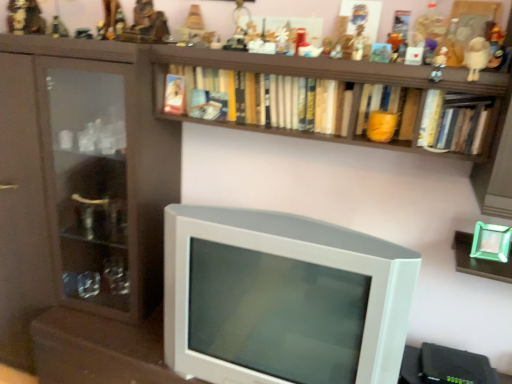
Question: Is metallic figurine at upper center, placed as the eighth toy when sorted from right to left, taller or shorter than hardcover books at upper center, acting as the 3th book starting from the right?

Choices:
 (A) short
 (B) tall

Answer: (B)

Question: Is metallic figurine at upper center, placed as the eighth toy when sorted from right to left, wider or thinner than hardcover books at upper center, acting as the 3th book starting from the right?

Choices:
 (A) thin
 (B) wide

Answer: (A)

Question: Considering the real-world distances, which object is farthest from the white plastic television at center?

Choices:
 (A) hardcover book at upper right, the first book from the right
 (B) white plush toy at upper right, positioned as the 10th toy in left-to-right order
 (C) orange matte book at center, acting as the second book starting from the right
 (D) matte plastic figurine at upper center, the ninth toy positioned from the left
 (E) white plastic figurine at upper right, which appears as the eleventh toy when viewed from the left

Answer: (E)

Question: Which object is the closest to the matte plastic figurine at upper center, the ninth toy positioned from the left?

Choices:
 (A) metallic figurine at upper center, placed as the eighth toy when sorted from right to left
 (B) white plush toy at upper right, positioned as the 10th toy in left-to-right order
 (C) metallic gold figurine at upper center, which ranks as the seventh toy in right-to-left order
 (D) matte plastic toy at upper center, marked as the 4th toy in a right-to-left arrangement
 (E) metallic figurine at upper center, the ninth toy from the right

Answer: (D)